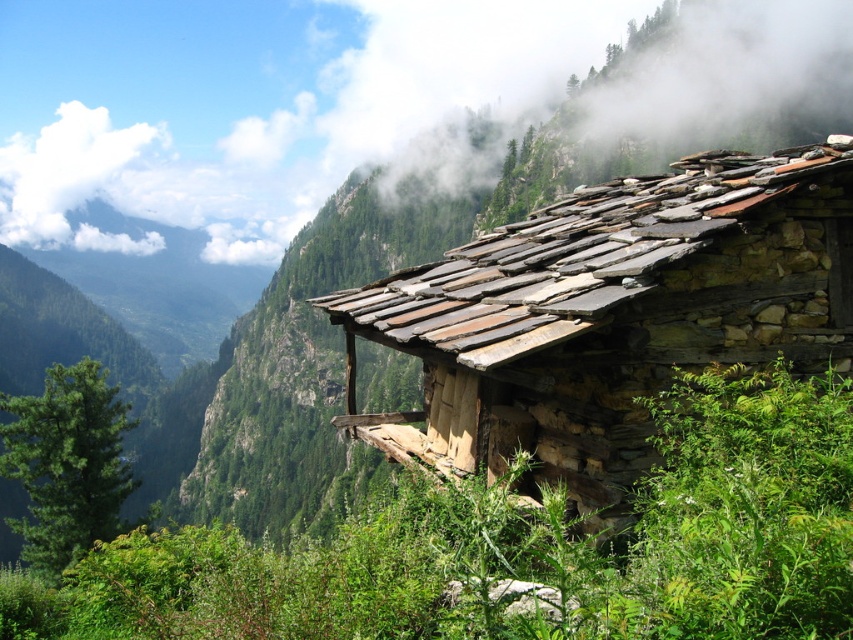
Question: Does green leafy plant at lower center appear over green leafy tree at left?

Choices:
 (A) no
 (B) yes

Answer: (B)

Question: Which point is farther from the camera taking this photo?

Choices:
 (A) (103, 369)
 (B) (550, 614)
 (C) (773, 156)

Answer: (A)

Question: Is green leafy plant at lower center to the left of green leafy tree at left from the viewer's perspective?

Choices:
 (A) no
 (B) yes

Answer: (A)

Question: Estimate the real-world distances between objects in this image. Which object is farther from the green leafy tree at left?

Choices:
 (A) green leafy plant at lower center
 (B) rustic stone cabin at upper right

Answer: (B)

Question: Is green leafy plant at lower center closer to the viewer compared to green leafy tree at left?

Choices:
 (A) no
 (B) yes

Answer: (B)

Question: Which point appears closest to the camera in this image?

Choices:
 (A) (828, 148)
 (B) (764, 595)
 (C) (22, 451)

Answer: (B)